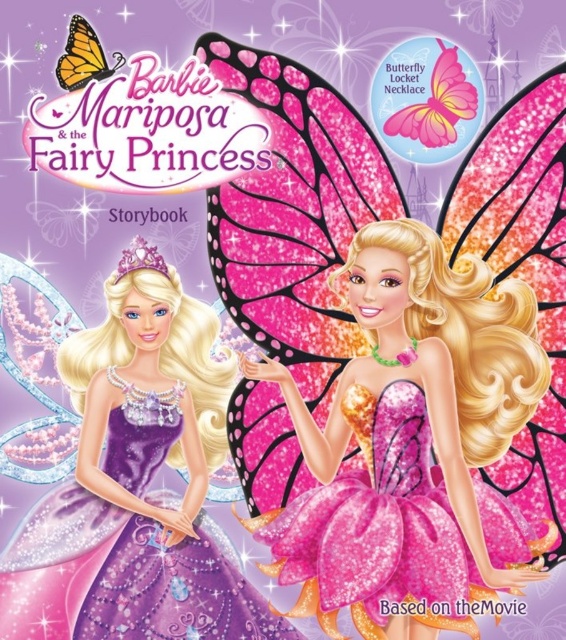
What do you see at coordinates (413, 445) in the screenshot? I see `pink glitter dress at center` at bounding box center [413, 445].

Does pink glitter dress at center appear on the left side of purple satin dress at left?

Incorrect, pink glitter dress at center is not on the left side of purple satin dress at left.

Is point (380, 260) closer to viewer compared to point (171, 618)?

No, (380, 260) is behind (171, 618).

At what (x,y) coordinates should I click in order to perform the action: click on pink glitter dress at center. Please return your answer as a coordinate pair (x, y). This screenshot has width=566, height=640. Looking at the image, I should click on (413, 445).